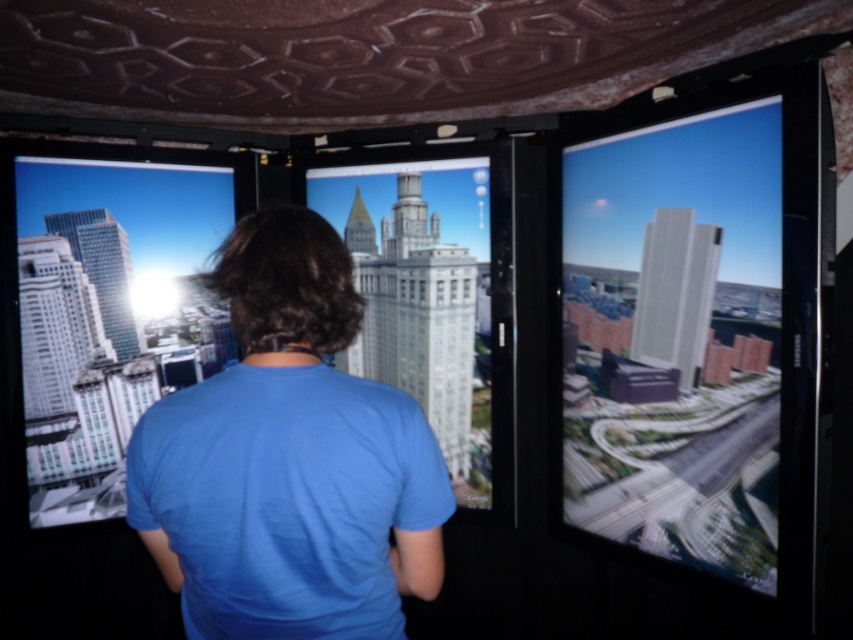
In the scene shown: Is white glossy building at left to the right of white glossy building at center from the viewer's perspective?

Incorrect, white glossy building at left is not on the right side of white glossy building at center.

This screenshot has width=853, height=640. Describe the element at coordinates (109, 314) in the screenshot. I see `white glossy building at left` at that location.

In order to click on white glossy building at left in this screenshot , I will do `click(109, 314)`.

Looking at this image, who is more distant from viewer, (334, 620) or (463, 378)?

Positioned behind is point (463, 378).

Looking at this image, between blue cotton shirt at center and white glossy building at center, which one has less height?

With less height is blue cotton shirt at center.

Image resolution: width=853 pixels, height=640 pixels. What do you see at coordinates (289, 460) in the screenshot?
I see `blue cotton shirt at center` at bounding box center [289, 460].

Where is `blue cotton shirt at center`? The width and height of the screenshot is (853, 640). blue cotton shirt at center is located at coordinates (289, 460).

Does smooth glass skyscraper at right appear over blue cotton shirt at center?

Correct, smooth glass skyscraper at right is located above blue cotton shirt at center.

The height and width of the screenshot is (640, 853). What are the coordinates of `smooth glass skyscraper at right` in the screenshot? It's located at click(x=675, y=339).

Is point (573, 483) closer to viewer compared to point (299, 579)?

That is False.

I want to click on smooth glass skyscraper at right, so click(675, 339).